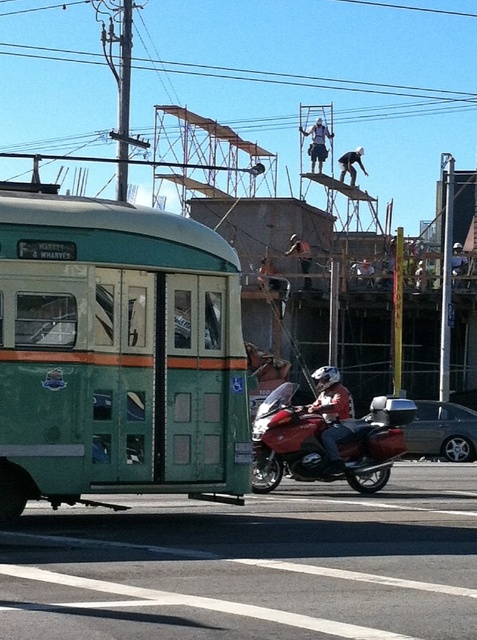
You are a pedestrian standing on the sidewalk and want to cross the street. There is a red leather jacket at center. Where is the red leather jacket located in relation to the vintage green trolleybus?

The red leather jacket at center is located to the right of the vintage green trolleybus, as it is positioned at point (332,413) in the image coordinates.

You are standing at the point marked by the coordinates point (325, 440). Looking around, you see a vintage green trolleybus with orange accents and a motorcyclist on a red motorcycle. Which direction should you turn to face the glossy red motorcycle at center?

The point marked by the coordinates point (325, 440) already faces the glossy red motorcycle at center, so you don not need to turn.